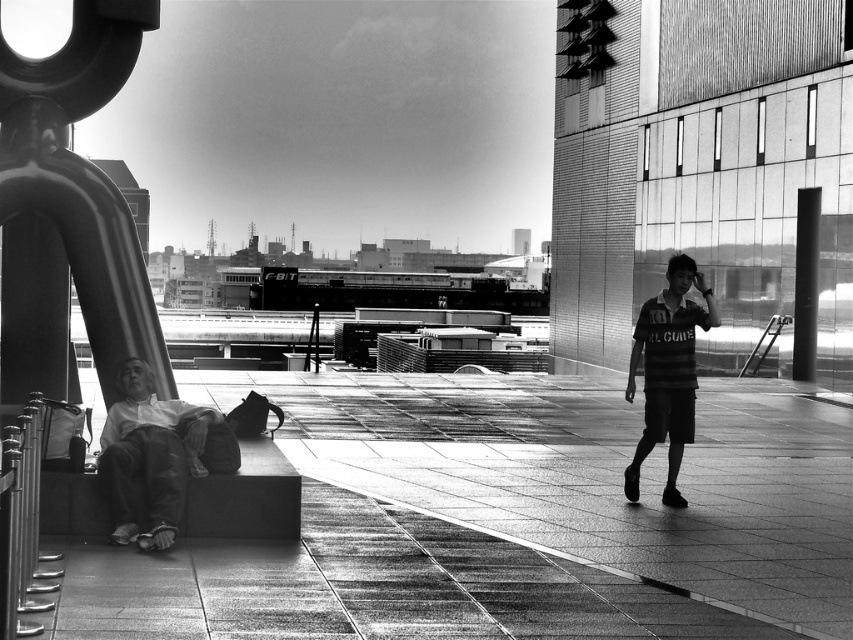
Question: Which point is farther from the camera taking this photo?

Choices:
 (A) (161, 412)
 (B) (766, 508)
 (C) (688, 417)

Answer: (B)

Question: Considering the relative positions of light gray cotton pants at lower left and striped jersey at center in the image provided, where is light gray cotton pants at lower left located with respect to striped jersey at center?

Choices:
 (A) below
 (B) above

Answer: (A)

Question: Is smooth concrete pavement at center to the right of light gray cotton pants at lower left from the viewer's perspective?

Choices:
 (A) yes
 (B) no

Answer: (A)

Question: Does smooth concrete pavement at center have a greater width compared to striped jersey at center?

Choices:
 (A) no
 (B) yes

Answer: (B)

Question: Which of these objects is positioned farthest from the light gray cotton pants at lower left?

Choices:
 (A) striped jersey at center
 (B) smooth concrete pavement at center

Answer: (A)

Question: Which of these objects is positioned closest to the smooth concrete pavement at center?

Choices:
 (A) striped jersey at center
 (B) light gray cotton pants at lower left

Answer: (B)